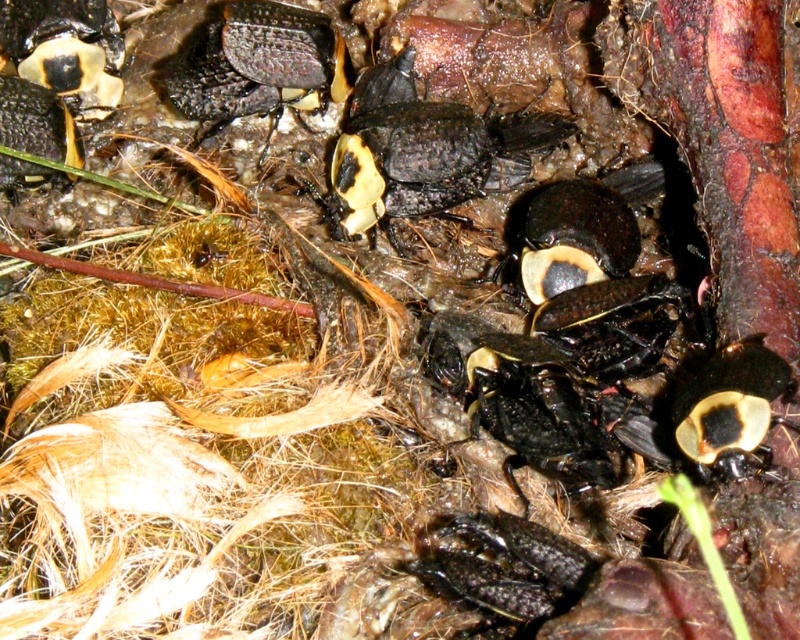
Question: Does matte black beetle at center appear on the left side of shiny black beetle at upper center?

Choices:
 (A) yes
 (B) no

Answer: (B)

Question: Does matte black beetle at center have a greater width compared to shiny black beetle at upper center?

Choices:
 (A) yes
 (B) no

Answer: (A)

Question: Does matte black beetle at center have a smaller size compared to shiny black beetle at upper center?

Choices:
 (A) no
 (B) yes

Answer: (A)

Question: Which point is closer to the camera?

Choices:
 (A) matte black beetle at center
 (B) shiny black beetle at upper center

Answer: (B)